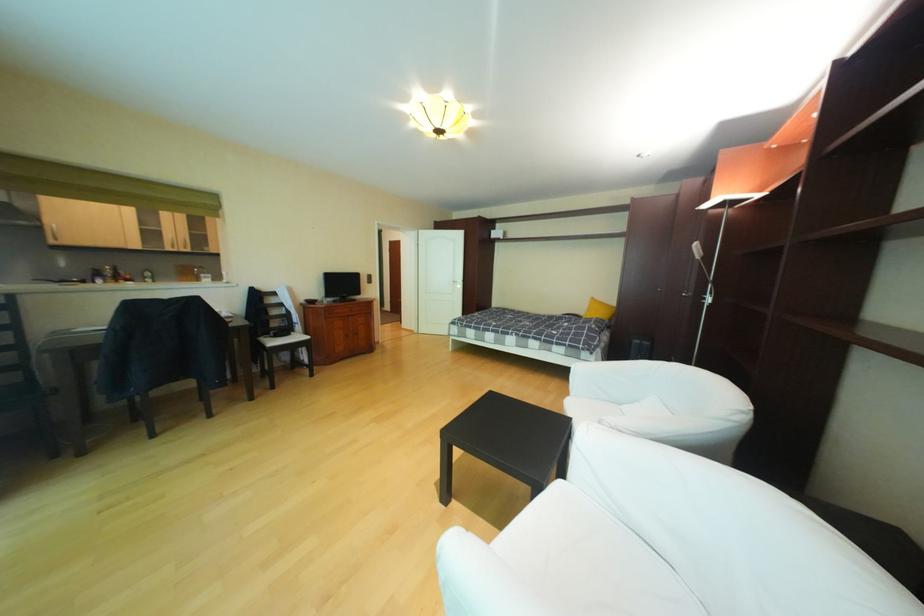
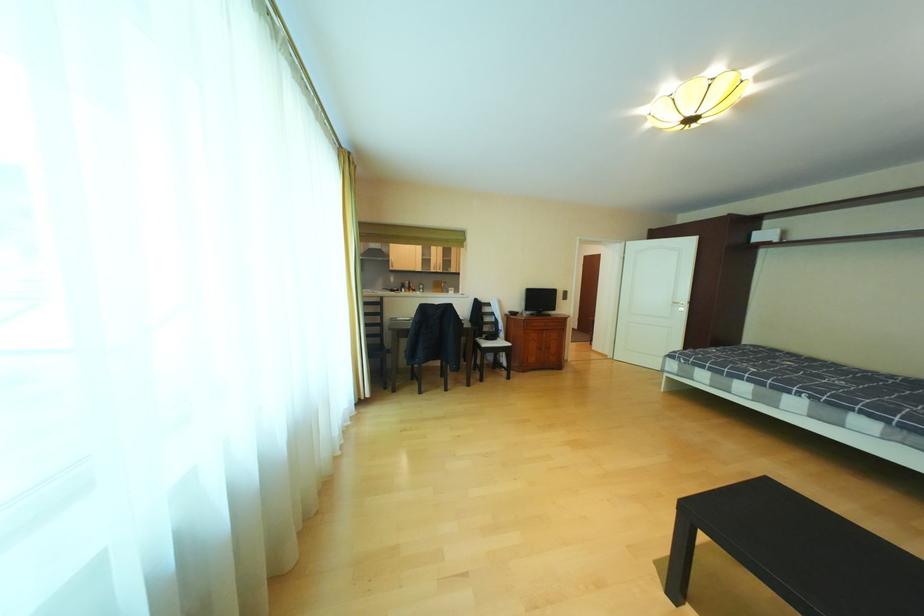
In the second image, find the point that corresponds to (273,347) in the first image.

(490, 346)